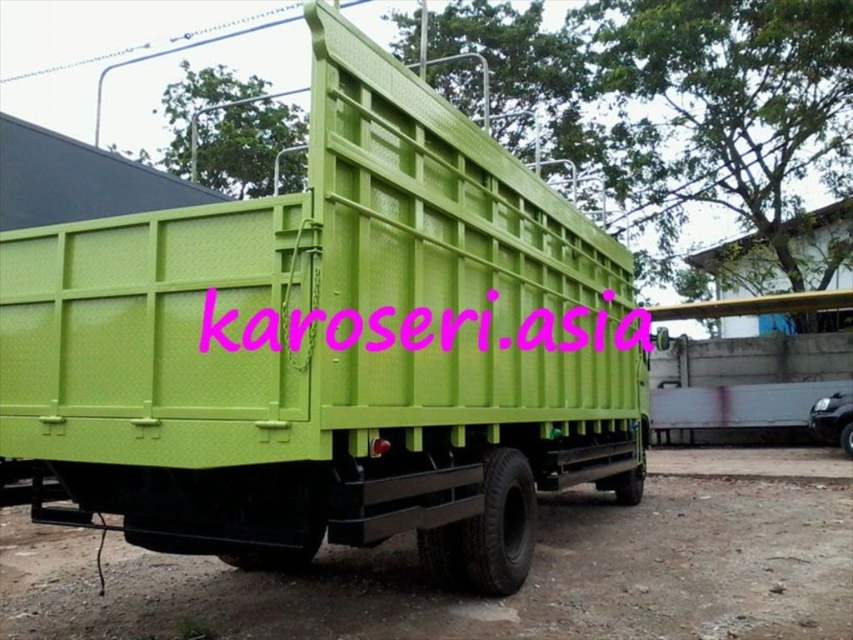
Can you confirm if lime green plastic truck at center is positioned below pink text at center?

Yes, lime green plastic truck at center is below pink text at center.

Image resolution: width=853 pixels, height=640 pixels. In order to click on lime green plastic truck at center in this screenshot , I will do `click(329, 348)`.

Locate an element on the screen. This screenshot has width=853, height=640. lime green plastic truck at center is located at coordinates (329, 348).

I want to click on lime green plastic truck at center, so click(329, 348).